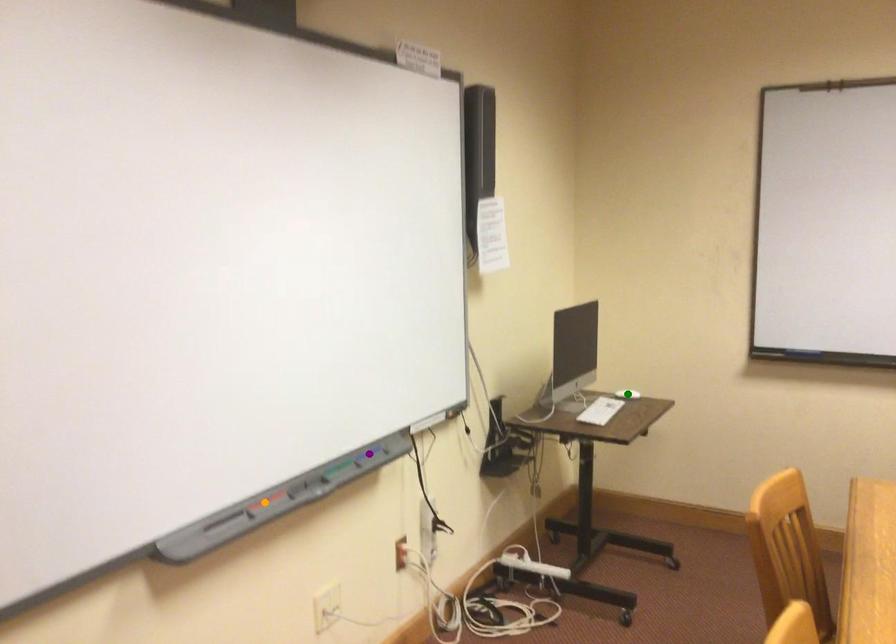
Order these from nearest to farthest:
- green point
- orange point
- purple point

green point
purple point
orange point